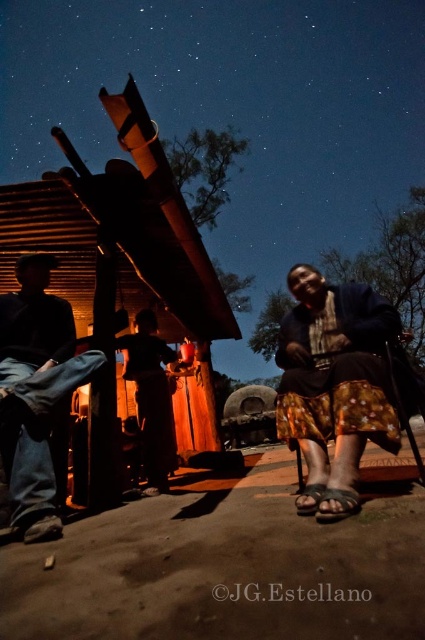
What are the coordinates of `printed fabric skirt at lower right` in the screenshot? It's located at (334, 385).

Does printed fabric skirt at lower right appear on the left side of brushed metal pants at lower left?

Incorrect, printed fabric skirt at lower right is not on the left side of brushed metal pants at lower left.

Is point (308, 316) in front of point (57, 403)?

Yes, point (308, 316) is closer to viewer.

Image resolution: width=425 pixels, height=640 pixels. I want to click on printed fabric skirt at lower right, so click(334, 385).